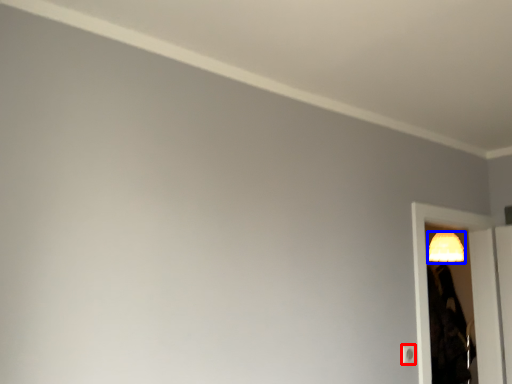
Question: Which object appears closest to the camera in this image, light switch (highlighted by a red box) or lamp (highlighted by a blue box)?

Choices:
 (A) light switch
 (B) lamp

Answer: (A)